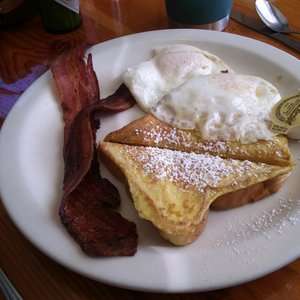
This screenshot has width=300, height=300. Identify the location of wooden tabletop. (135, 21).